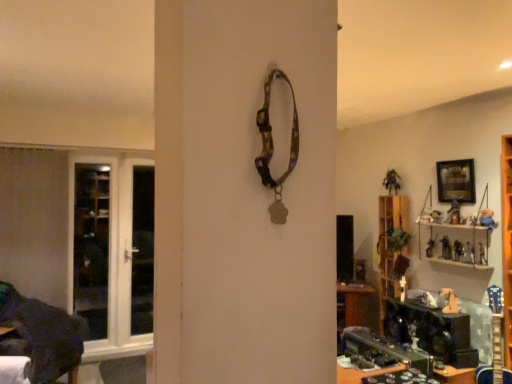
The image size is (512, 384). Find the location of `wooden framed picture at upper right`. wooden framed picture at upper right is located at coordinates (456, 181).

This screenshot has height=384, width=512. Describe the element at coordinates (111, 241) in the screenshot. I see `white glossy door at left` at that location.

Measure the distance between point (140,305) and camera.

The depth of point (140,305) is 15.45 feet.

At what (x,y) coordinates should I click in order to perform the action: click on wooden shelf at right. Please return your answer as a coordinate pair (x, y). Looking at the image, I should click on (456, 244).

Locate an element on the screen. This screenshot has width=512, height=384. wooden framed picture at upper right is located at coordinates (456, 181).

Where is `screen door below the wooden framed picture at upper right (from a real-world perspective)`? screen door below the wooden framed picture at upper right (from a real-world perspective) is located at coordinates (136, 245).

Can you tell me how much transparent glass screen door at left and wooden framed picture at upper right differ in facing direction?

transparent glass screen door at left and wooden framed picture at upper right are facing 90 degrees away from each other.

Is transparent glass screen door at left taller than wooden framed picture at upper right?

Correct, transparent glass screen door at left is much taller as wooden framed picture at upper right.

Does point (149, 174) come closer to viewer compared to point (450, 192)?

No, (149, 174) is behind (450, 192).

Is white glossy door at left oriented away from transparent glass screen door at left?

Yes, white glossy door at left is facing away from transparent glass screen door at left.

Is white glossy door at left spatially inside transparent glass screen door at left, or outside of it?

white glossy door at left is spatially positioned inside transparent glass screen door at left.

Is white glossy door at left bigger or smaller than transparent glass screen door at left?

white glossy door at left is bigger than transparent glass screen door at left.

Is wooden shelf at right smaller than white glossy door at left?

Correct, wooden shelf at right occupies less space than white glossy door at left.

Is wooden shelf at right in front of or behind white glossy door at left in the image?

Visually, wooden shelf at right is located in front of white glossy door at left.

Is wooden shelf at right wider or thinner than white glossy door at left?

Clearly, wooden shelf at right has more width compared to white glossy door at left.

Can you confirm if wooden shelf at right is shorter than transparent glass screen door at left?

Yes.

Is wooden shelf at right thinner than transparent glass screen door at left?

No.

From a real-world perspective, which object rests below the other?

transparent glass screen door at left is physically lower.

How many degrees apart are the facing directions of wooden shelf at right and transparent glass screen door at left?

The angle between the facing direction of wooden shelf at right and the facing direction of transparent glass screen door at left is 90 degrees.

Can you tell me how much wooden framed picture at upper right and wooden shelf at right differ in facing direction?

Answer: The facing directions of wooden framed picture at upper right and wooden shelf at right are 0.00308 degrees apart.

Could you tell me if wooden framed picture at upper right is facing wooden shelf at right?

No, wooden framed picture at upper right does not turn towards wooden shelf at right.

Is the position of wooden framed picture at upper right more distant than that of wooden shelf at right?

Yes.

From the image's perspective, which is above, wooden framed picture at upper right or wooden shelf at right?

wooden framed picture at upper right is shown above in the image.

Is white glossy door at left oriented away from wooden shelf at right?

white glossy door at left does not have its back to wooden shelf at right.

Considering the positions of objects white glossy door at left and wooden shelf at right in the image provided, who is behind, white glossy door at left or wooden shelf at right?

Positioned behind is white glossy door at left.

Would you say wooden shelf at right is part of white glossy door at left's contents?

No, wooden shelf at right is not inside white glossy door at left.

Based on the photo, is white glossy door at left to the left of wooden shelf at right from the viewer's perspective?

Indeed, white glossy door at left is positioned on the left side of wooden shelf at right.

Which object is wider, white glossy door at left or wooden framed picture at upper right?

wooden framed picture at upper right.

Is white glossy door at left bigger than wooden framed picture at upper right?

Correct, white glossy door at left is larger in size than wooden framed picture at upper right.

Does point (123, 273) appear closer or farther from the camera than point (445, 188)?

Point (123, 273) is positioned farther from the camera compared to point (445, 188).

Which object is more forward, white glossy door at left or wooden framed picture at upper right?

wooden framed picture at upper right is closer to the camera.

Where is `screen door below the wooden framed picture at upper right (from a real-world perspective)`? The height and width of the screenshot is (384, 512). screen door below the wooden framed picture at upper right (from a real-world perspective) is located at coordinates (136, 245).

The width and height of the screenshot is (512, 384). Identify the location of screen door behind the white glossy door at left. (136, 245).

From the image, which object appears to be farther from wooden framed picture at upper right, transparent glass screen door at left or wooden shelf at right?

transparent glass screen door at left.

From the image, which object appears to be farther from white glossy door at left, transparent glass screen door at left or wooden shelf at right?

Based on the image, wooden shelf at right appears to be further to white glossy door at left.

Looking at this image, considering their positions, is white glossy door at left positioned further to wooden shelf at right than transparent glass screen door at left?

Among the two, white glossy door at left is located further to wooden shelf at right.

From the image, which object appears to be nearer to wooden framed picture at upper right, wooden shelf at right or white glossy door at left?

wooden shelf at right lies closer to wooden framed picture at upper right than the other object.

Looking at the image, which one is located closer to transparent glass screen door at left, wooden shelf at right or white glossy door at left?

The object closer to transparent glass screen door at left is white glossy door at left.

From the image, which object appears to be nearer to wooden shelf at right, wooden framed picture at upper right or transparent glass screen door at left?

wooden framed picture at upper right.

Considering their positions, is wooden shelf at right positioned further to white glossy door at left than wooden framed picture at upper right?

Among the two, wooden framed picture at upper right is located further to white glossy door at left.

Considering their positions, is white glossy door at left positioned closer to transparent glass screen door at left than wooden shelf at right?

white glossy door at left lies closer to transparent glass screen door at left than the other object.

This screenshot has height=384, width=512. I want to click on shelf between transparent glass screen door at left and wooden framed picture at upper right in the horizontal direction, so click(456, 244).

Locate an element on the screen. screen door located between white glossy door at left and wooden framed picture at upper right in the left-right direction is located at coordinates (136, 245).

Locate an element on the screen. Image resolution: width=512 pixels, height=384 pixels. screen door located between white glossy door at left and wooden shelf at right in the left-right direction is located at coordinates (136, 245).

Image resolution: width=512 pixels, height=384 pixels. What are the coordinates of `shelf located between white glossy door at left and wooden framed picture at upper right in the left-right direction` in the screenshot? It's located at (456, 244).